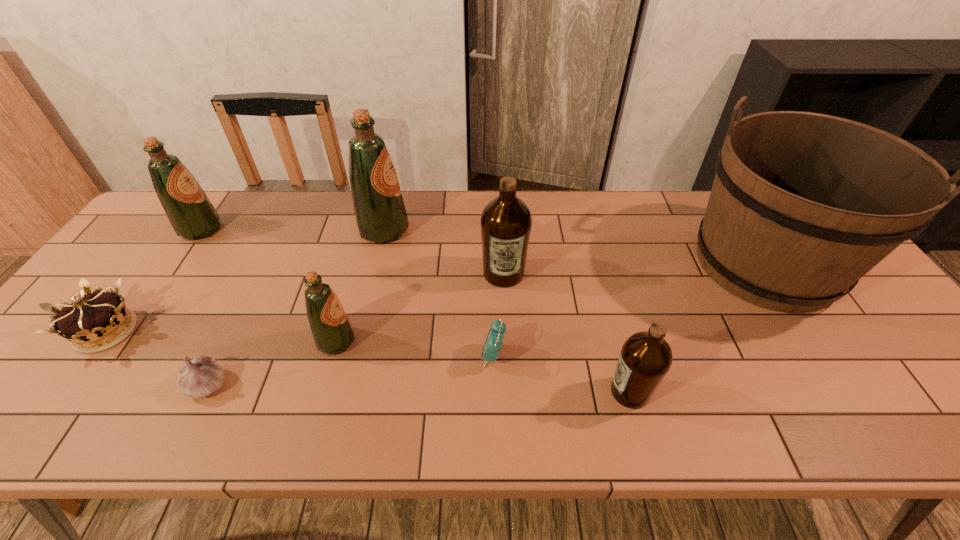
I want to click on olive oil situated at the left edge, so click(x=191, y=214).

Locate an element on the screen. crown that is at the left edge is located at coordinates (91, 323).

Where is `object located at the right edge`? object located at the right edge is located at coordinates (803, 205).

At what (x,y) coordinates should I click in order to perform the action: click on object located in the far left corner section of the desktop. Please return your answer as a coordinate pair (x, y). The height and width of the screenshot is (540, 960). Looking at the image, I should click on (191, 214).

Find the location of a particular element. object that is at the far right corner is located at coordinates (803, 205).

Where is `vacant position at the far edge of the desktop`? This screenshot has height=540, width=960. vacant position at the far edge of the desktop is located at coordinates (552, 235).

In the image, there is a desktop. At what (x,y) coordinates should I click in order to perform the action: click on vacant space at the near edge. Please return your answer as a coordinate pair (x, y). This screenshot has height=540, width=960. Looking at the image, I should click on 551,409.

Locate an element on the screen. The image size is (960, 540). vacant space at the left edge of the desktop is located at coordinates (159, 249).

In the image, there is a desktop. In order to click on free space at the right edge in this screenshot , I will do `click(860, 291)`.

The height and width of the screenshot is (540, 960). Find the location of `vacant space at the near left corner of the desktop`. vacant space at the near left corner of the desktop is located at coordinates (4, 402).